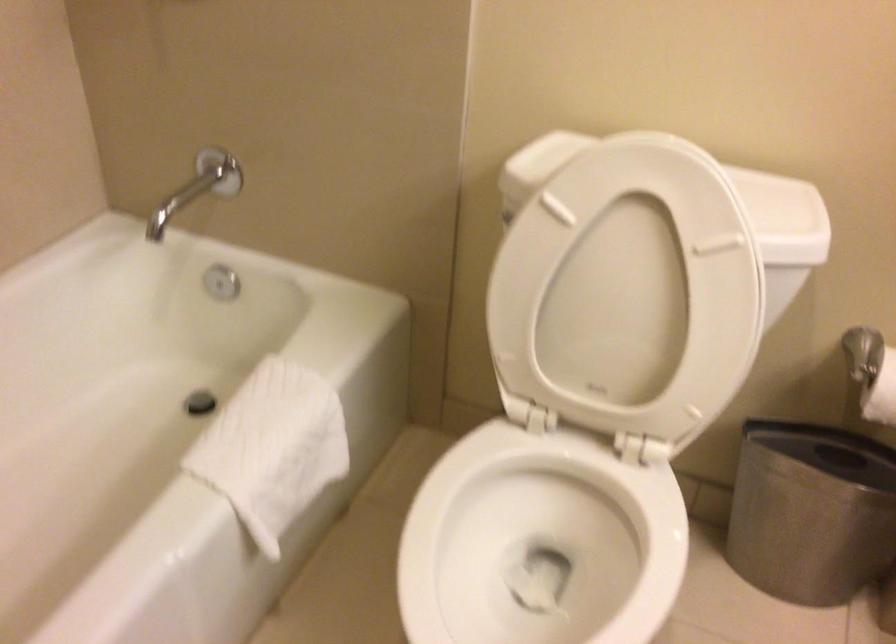
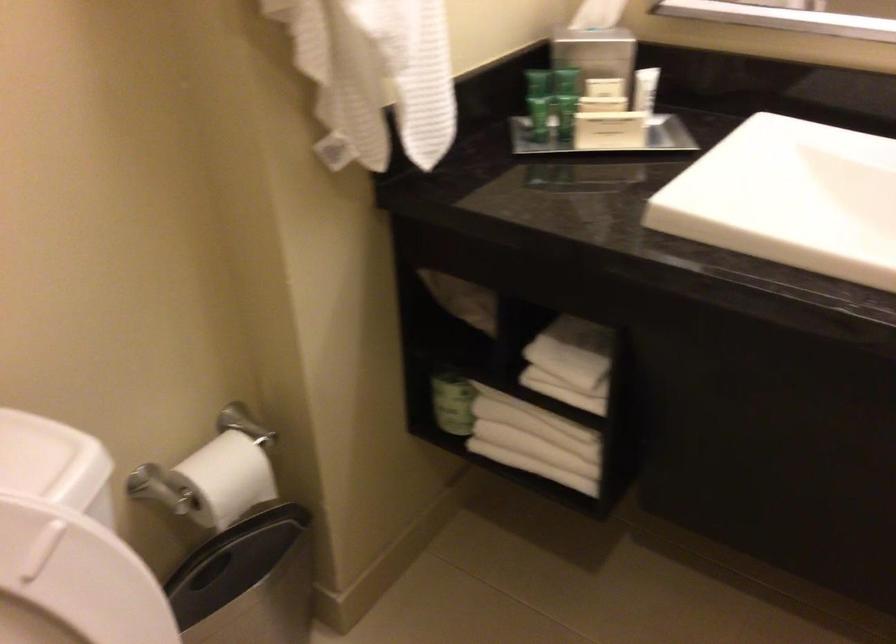
The images are taken continuously from a first-person perspective. In which direction is your viewpoint rotating?

The camera rotated toward right-down.